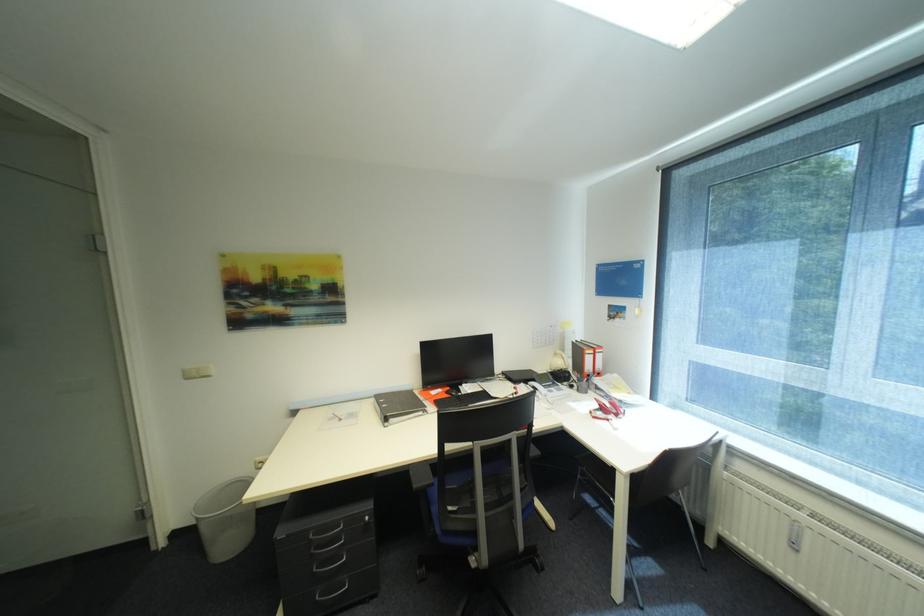
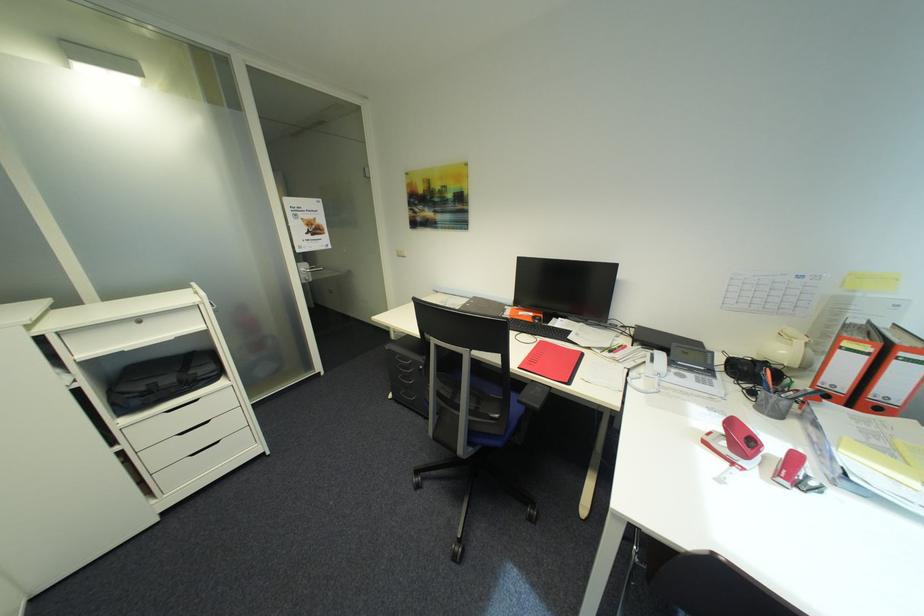
Question: I am providing you with two images of the same scene from different viewpoints. Which of the following objects are not visible in image2?

Choices:
 (A) black chair armrest
 (B) red hole punch
 (C) telephone handset
 (D) none of these

Answer: (D)